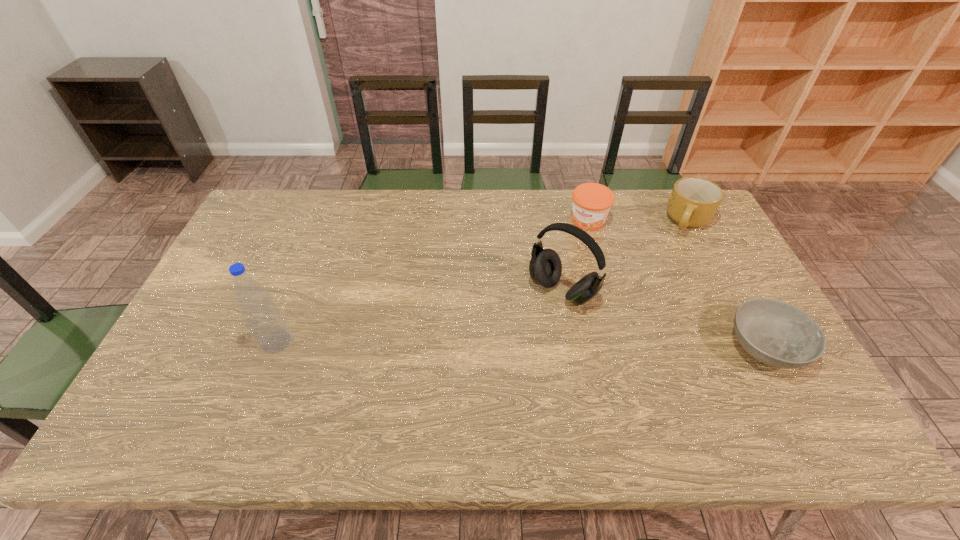
This screenshot has width=960, height=540. I want to click on object that can be found as the fourth closest to the shortest object, so click(265, 322).

The height and width of the screenshot is (540, 960). I want to click on free location that satisfies the following two spatial constraints: 1. on the front side of the fourth shortest object; 2. on the left side of the bowl, so click(572, 347).